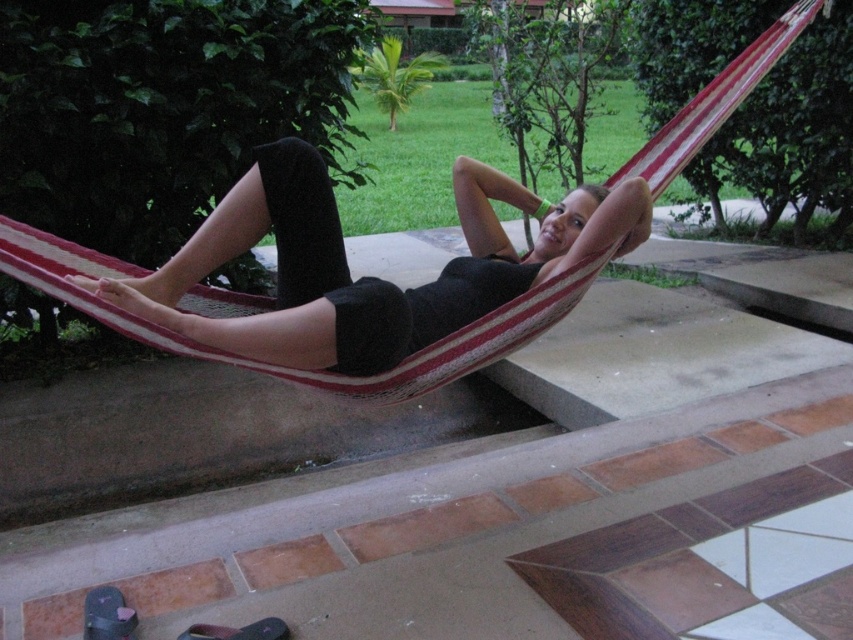
Does striped fabric hammock at center have a smaller size compared to dark gray fabric sandal at lower left?

Actually, striped fabric hammock at center might be larger than dark gray fabric sandal at lower left.

In order to click on striped fabric hammock at center in this screenshot , I will do `click(292, 369)`.

Consider the image. Can you confirm if matte black shorts at center is bigger than dark gray fabric sandal at lower left?

Correct, matte black shorts at center is larger in size than dark gray fabric sandal at lower left.

Which is more to the left, matte black shorts at center or dark gray fabric sandal at lower left?

dark gray fabric sandal at lower left is more to the left.

Who is more forward, (119, 307) or (102, 586)?

Point (119, 307) is more forward.

Find the location of `matte black shorts at center`. matte black shorts at center is located at coordinates (368, 276).

Who is lower down, matte black shorts at center or black leather sandal at lower left?

black leather sandal at lower left

What do you see at coordinates (368, 276) in the screenshot?
I see `matte black shorts at center` at bounding box center [368, 276].

Locate an element on the screen. The image size is (853, 640). matte black shorts at center is located at coordinates (368, 276).